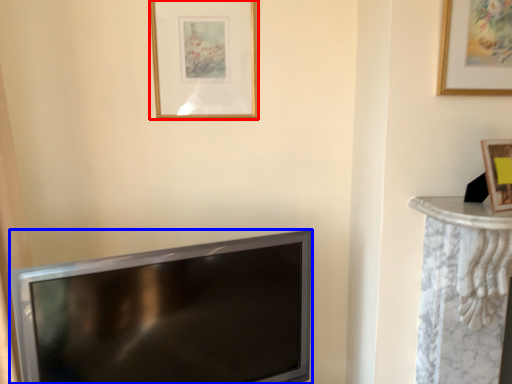
Question: Which point is closer to the camera, picture frame (highlighted by a red box) or television (highlighted by a blue box)?

Choices:
 (A) picture frame
 (B) television

Answer: (B)